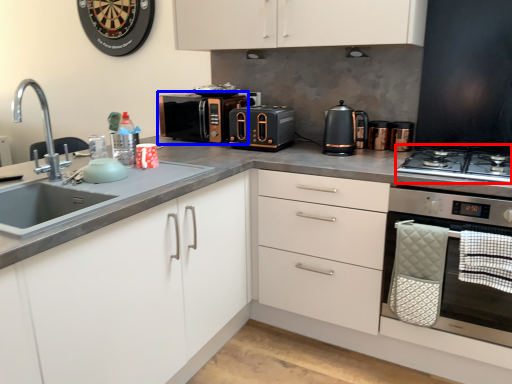
Question: Which point is closer to the camera, gas stove (highlighted by a red box) or microwave oven (highlighted by a blue box)?

Choices:
 (A) gas stove
 (B) microwave oven

Answer: (A)